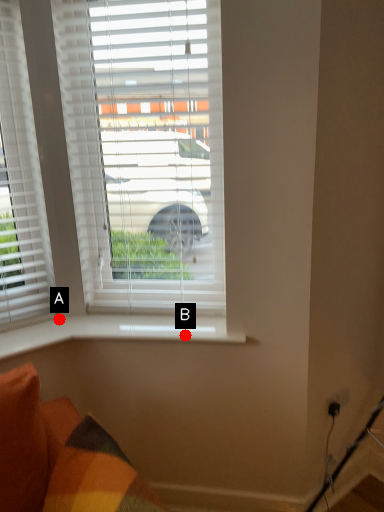
Question: Two points are circled on the image, labeled by A and B beside each circle. Which point is farther to the camera?

Choices:
 (A) A is further
 (B) B is further

Answer: (A)